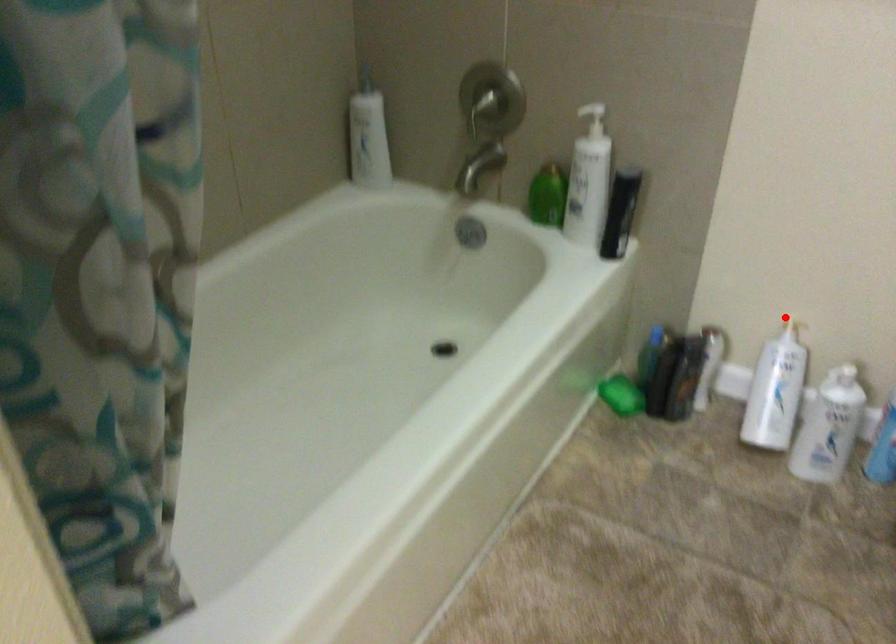
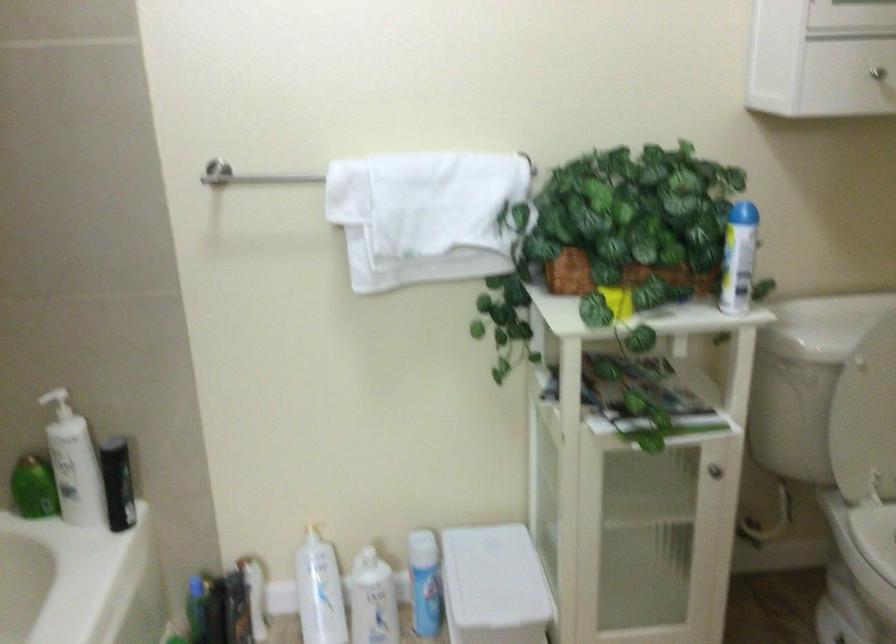
Where in the second image is the point corresponding to the highlighted location from the first image?

(306, 523)